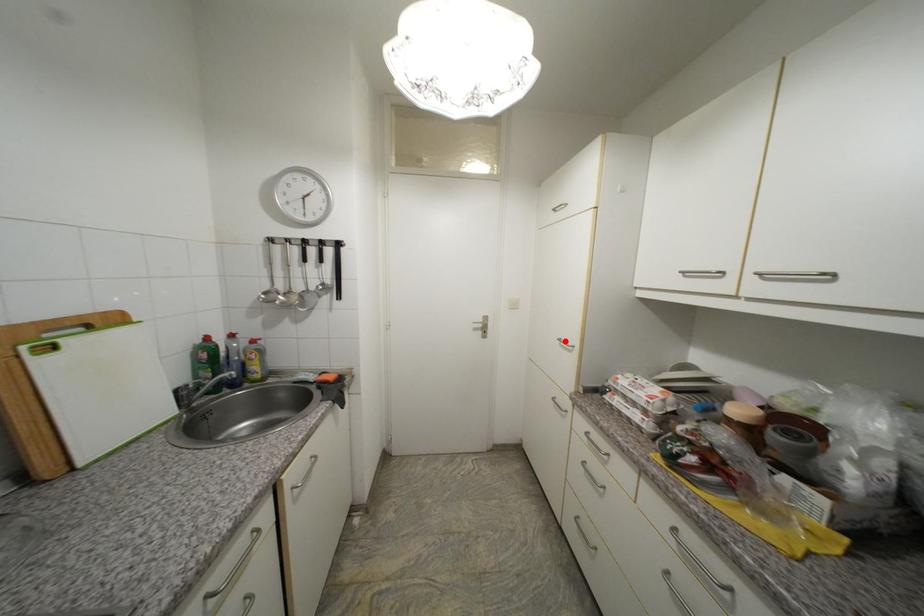
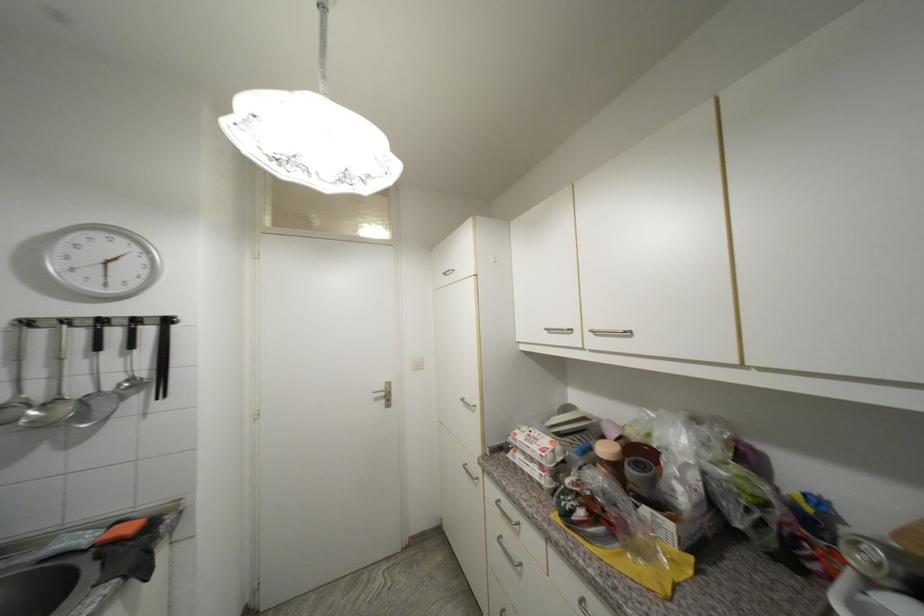
Find the pixel in the second image that matches the highlighted location in the first image.

(468, 400)